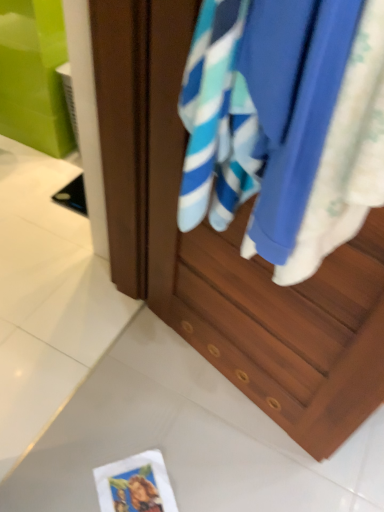
Locate an element on the screen. This screenshot has height=512, width=384. free location to the right of white paper postcard at lower center is located at coordinates (218, 480).